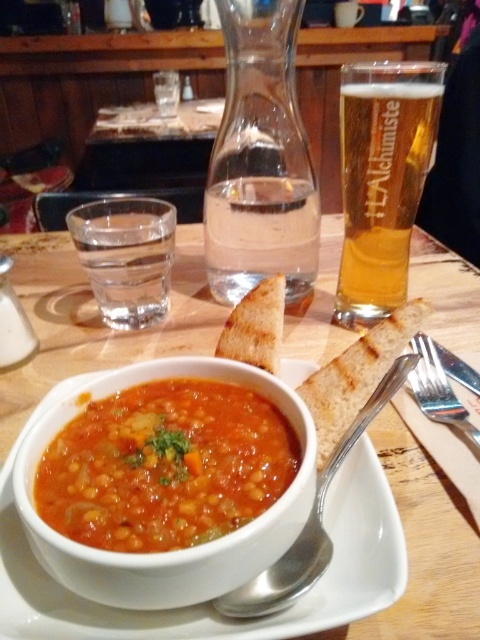
Where is the tomato soup at center located in the image?

The tomato soup at center is located at point (165, 465).

You are a diner who just arrived at the table and see the tomato soup at center and the silver spoon at center. How far apart are these two items?

The tomato soup at center and silver spoon at center are 1.67 inches apart from each other.

From the picture: You are a customer at this dining table and want to reach for the silver spoon at center to stir your soup. However, there is an amber glass beer at upper right in the way. Can you easily move the spoon without knocking over the beer?

The amber glass beer at upper right is to the right of the silver spoon at center, so the spoon is on the left side relative to the beer. Since the beer is positioned to the right of the spoon, you can easily reach for the spoon without disturbing the beer as they are placed apart from each other.